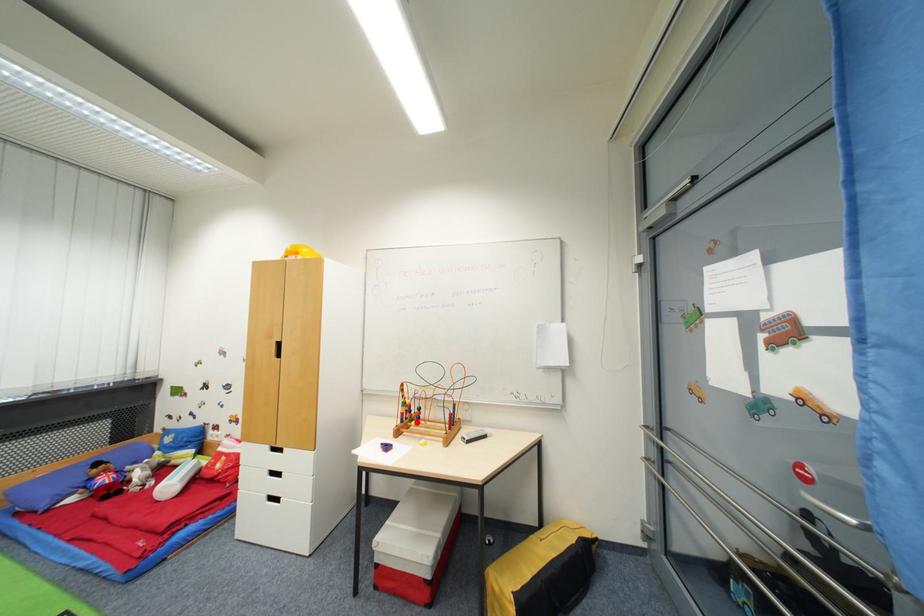
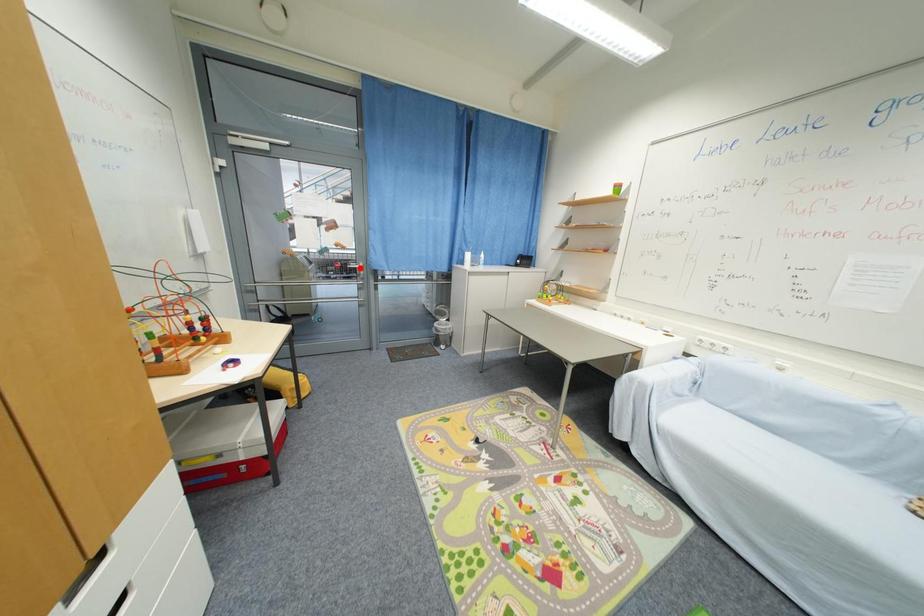
I am providing you with two images of the same scene from different viewpoints. A red point is marked on the first image and another point is marked on the second image. Is the red point in image1 aligned with the point shown in image2?

No